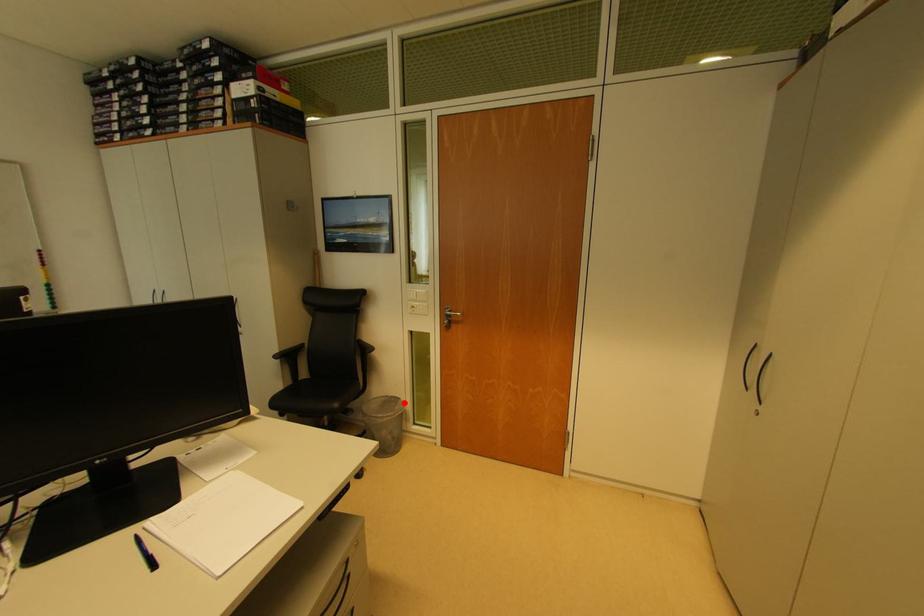
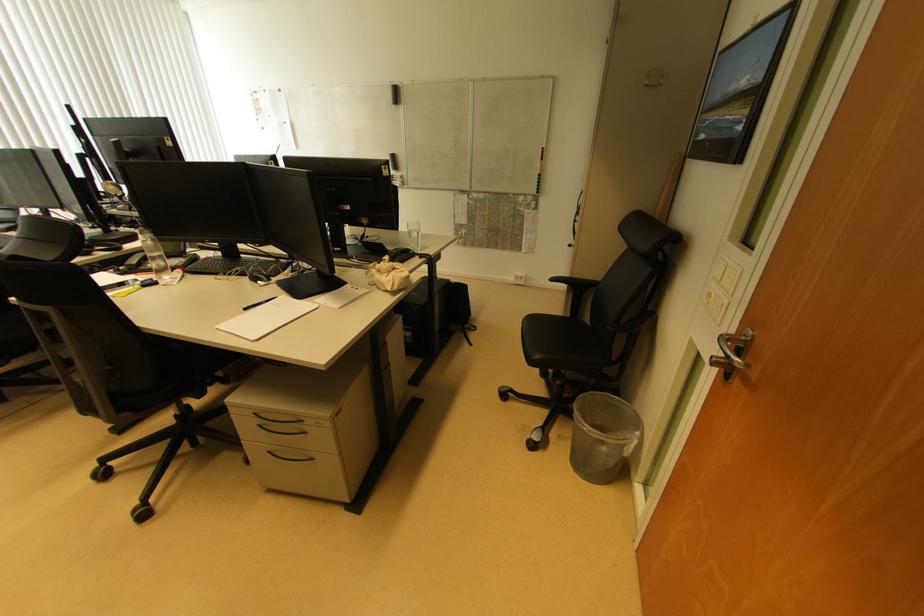
Locate, in the second image, the point that corresponds to the highlighted location in the first image.

(639, 437)